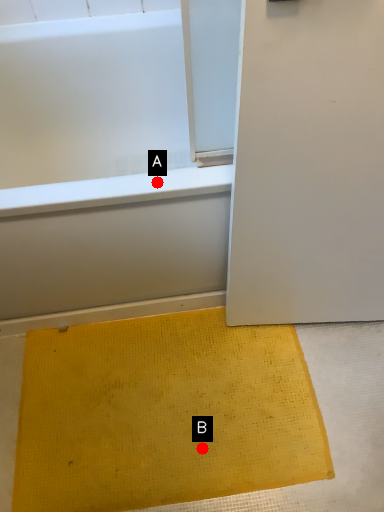
Question: Two points are circled on the image, labeled by A and B beside each circle. Which point is farther from the camera taking this photo?

Choices:
 (A) A is further
 (B) B is further

Answer: (B)